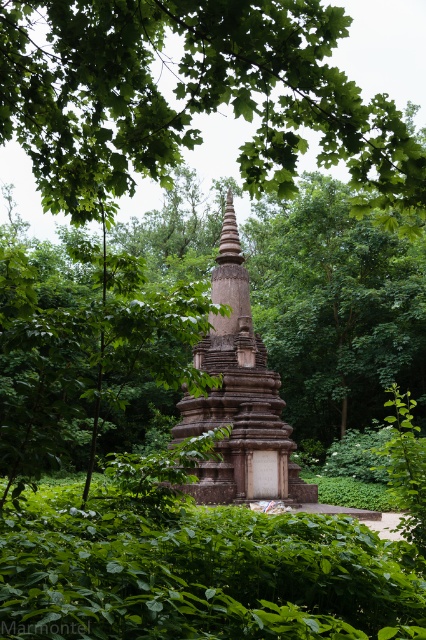
You are standing in front of the stone monument and want to determine the relative positions of two points marked on the structure. The first point is located at coordinates point (382,116) and the second at point (264,440). Which point is nearer to you?

Point (382,116) is closer to the viewer than point (264,440).

You are a visitor at the site and want to take a photo that includes both the green leafy tree at center and the brown stone tower at center. Which object should you position closer to the camera to ensure both are fully visible in the frame?

The green leafy tree at center is bigger than the brown stone tower at center, so positioning the green leafy tree at center closer to the camera will allow both objects to fit within the frame while ensuring the larger tree is fully visible.